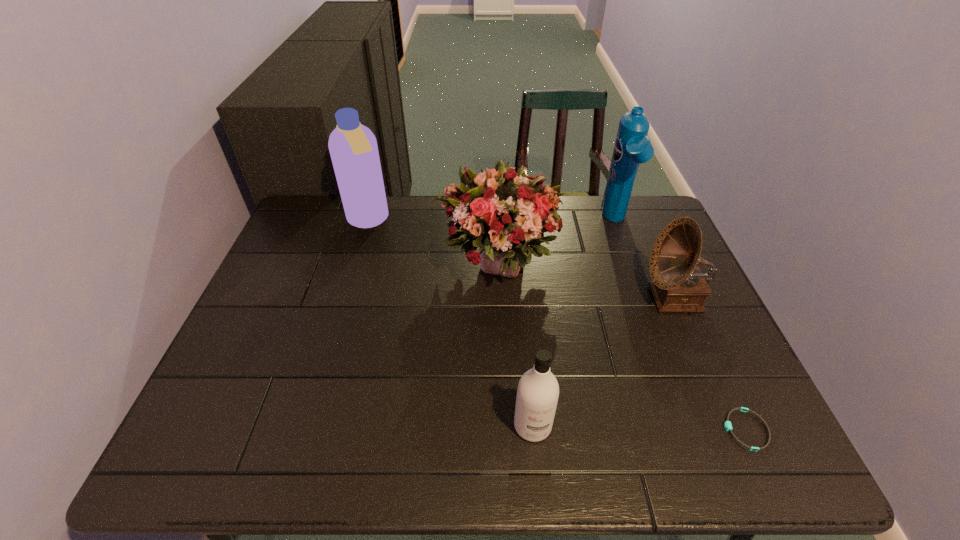
Identify which shampoo is located as the second nearest to the rightmost shampoo. Please provide its 2D coordinates. Your answer should be formatted as a tuple, i.e. [(x, y)], where the tuple contains the x and y coordinates of a point satisfying the conditions above.

[(353, 148)]

Point out which shampoo is positioned as the nearest to the rightmost shampoo. Please provide its 2D coordinates. Your answer should be formatted as a tuple, i.e. [(x, y)], where the tuple contains the x and y coordinates of a point satisfying the conditions above.

[(537, 394)]

The height and width of the screenshot is (540, 960). I want to click on blank space that satisfies the following two spatial constraints: 1. on the horn of the phonograph record; 2. on the front-facing side of the nearest shampoo, so click(730, 426).